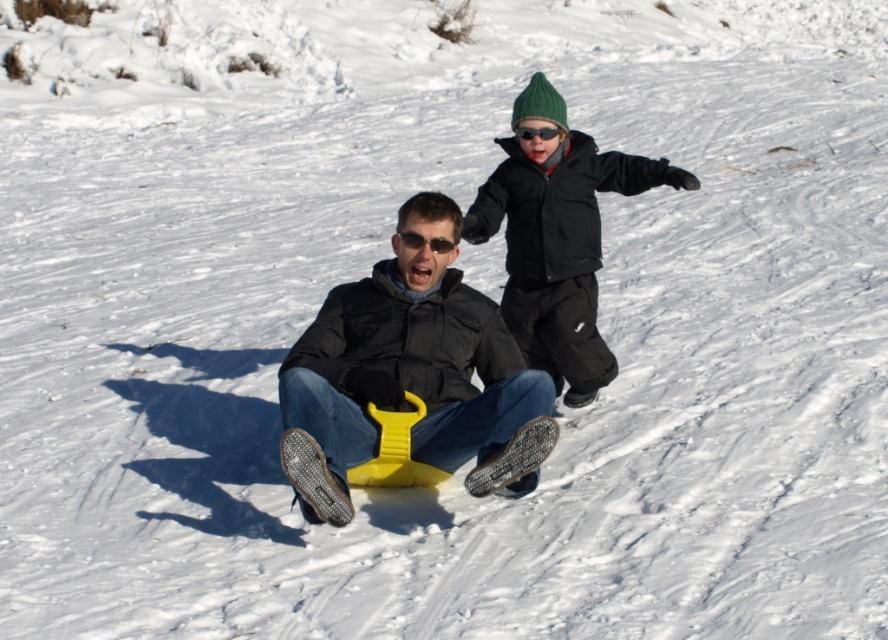
You are planning to buy a sled for your child. You see the yellow plastic sled at center and the green knit hat at upper right in the image. Which one is bigger?

The yellow plastic sled at center is bigger than the green knit hat at upper right.